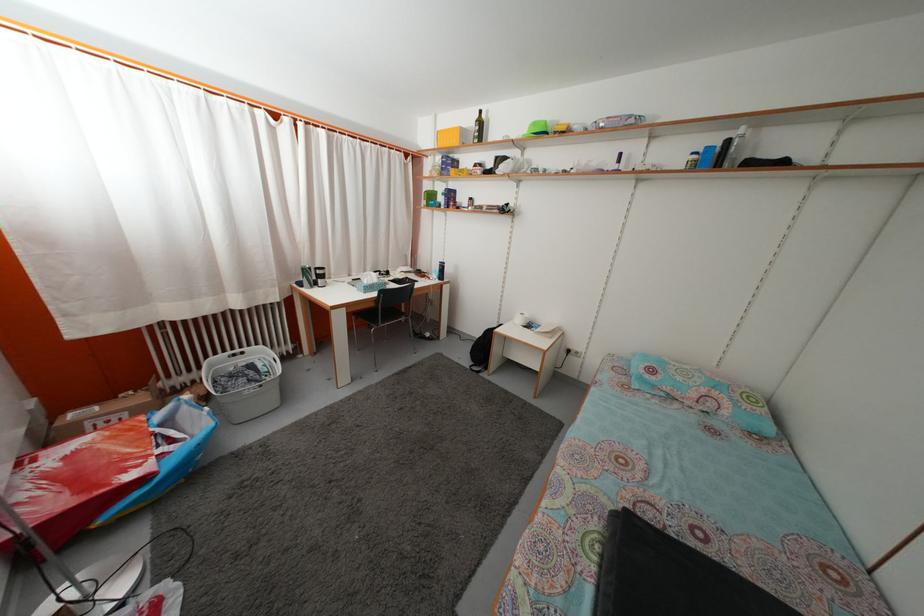
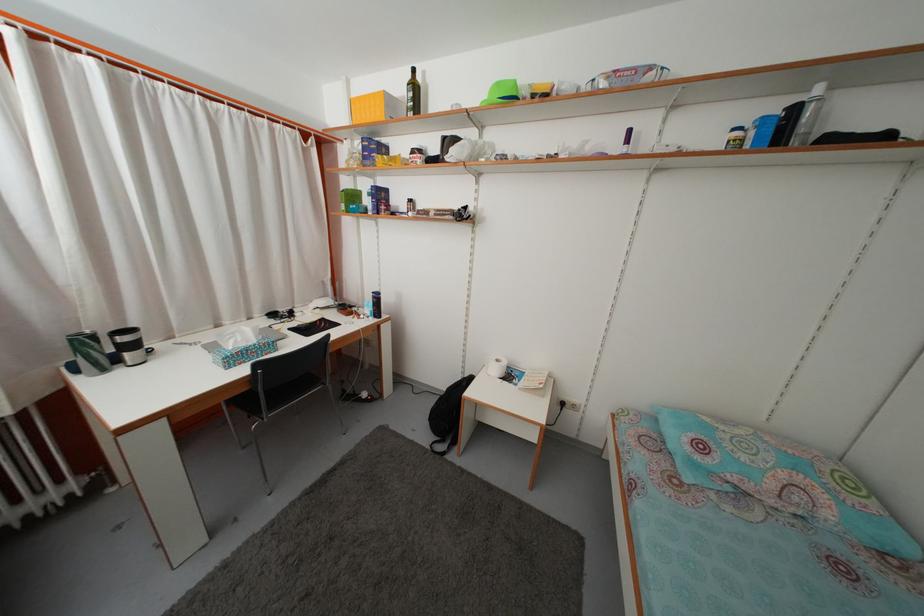
Question: The images are taken continuously from a first-person perspective. In which direction is your viewpoint rotating?

Choices:
 (A) Left
 (B) Right
 (C) Up
 (D) Down

Answer: (B)